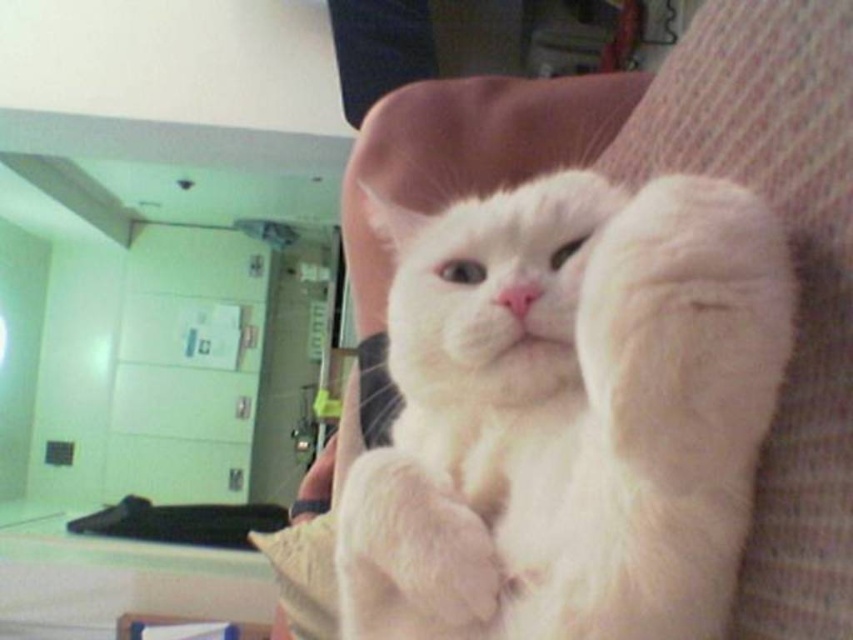
You are a photographer trying to capture the white fluffy cat at center and the white fluffy paw at center in a single shot. Since the cat is on the right side of its paw, where should you position your camera relative to the cat to ensure both are in frame?

The white fluffy cat at center is positioned on the right side of the white fluffy paw at center. To include both in the frame, position the camera to the left of the cat so that the cat and its paw are both visible.

You are a photographer trying to capture the white fluffy cat at center. The camera is set up at point 0.0, 0.0. Where should you aim the camera to ensure the cat is in the center of the photo?

The white fluffy cat at center is located at point (569, 413), so you should aim the camera towards those coordinates to center the cat in the photo.

You have a small toy that is 4 inches long. You want to place it between the white fluffy cat at center and the white fluffy paw at center. Will the toy fit in the space between them?

The white fluffy cat at center and white fluffy paw at center are 4.46 inches apart, so the 4 inch toy will fit between them since it is shorter than the space available.